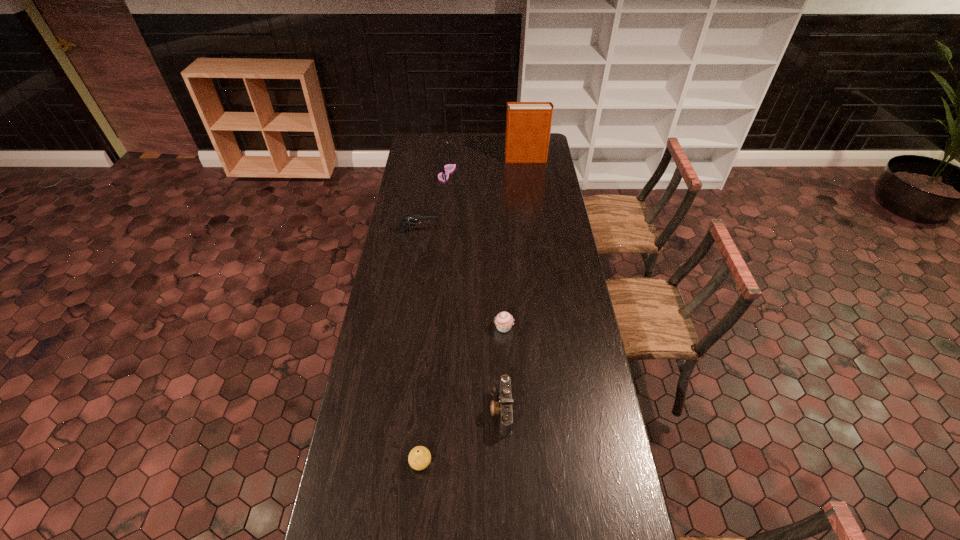
In order to click on free space that is in between the third farthest object and the fifth farthest object in this screenshot , I will do 460,321.

Where is `vacant space that is in between the nearest object and the camera`? This screenshot has width=960, height=540. vacant space that is in between the nearest object and the camera is located at coordinates (461, 436).

At what (x,y) coordinates should I click in order to perform the action: click on empty space between the camera and the third nearest object. Please return your answer as a coordinate pair (x, y). This screenshot has width=960, height=540. Looking at the image, I should click on (502, 369).

Choose which object is the third nearest neighbor to the tallest object. Please provide its 2D coordinates. Your answer should be formatted as a tuple, i.e. [(x, y)], where the tuple contains the x and y coordinates of a point satisfying the conditions above.

[(504, 321)]

Point out which object is positioned as the fourth nearest to the nearest object. Please provide its 2D coordinates. Your answer should be formatted as a tuple, i.e. [(x, y)], where the tuple contains the x and y coordinates of a point satisfying the conditions above.

[(449, 168)]

The height and width of the screenshot is (540, 960). Find the location of `vacant space that satisfies the following two spatial constraints: 1. at the end of the barrel of the fourth nearest object; 2. on the right side of the third nearest object`. vacant space that satisfies the following two spatial constraints: 1. at the end of the barrel of the fourth nearest object; 2. on the right side of the third nearest object is located at coordinates (405, 327).

In order to click on vacant area in the image that satisfies the following two spatial constraints: 1. on the back side of the pear; 2. on the right side of the fourth farthest object in this screenshot , I will do `click(433, 327)`.

This screenshot has height=540, width=960. In order to click on blank area in the image that satisfies the following two spatial constraints: 1. at the end of the barrel of the cupcake; 2. on the left side of the fourth nearest object in this screenshot , I will do `click(405, 327)`.

You are a GUI agent. You are given a task and a screenshot of the screen. Output one action in this format:
    pyautogui.click(x=<x>, y=<y>)
    Task: Click on the vacant space that satisfies the following two spatial constraints: 1. on the back side of the third nearest object; 2. at the end of the barrel of the gun
    The width and height of the screenshot is (960, 540).
    Given the screenshot: What is the action you would take?
    pyautogui.click(x=499, y=231)